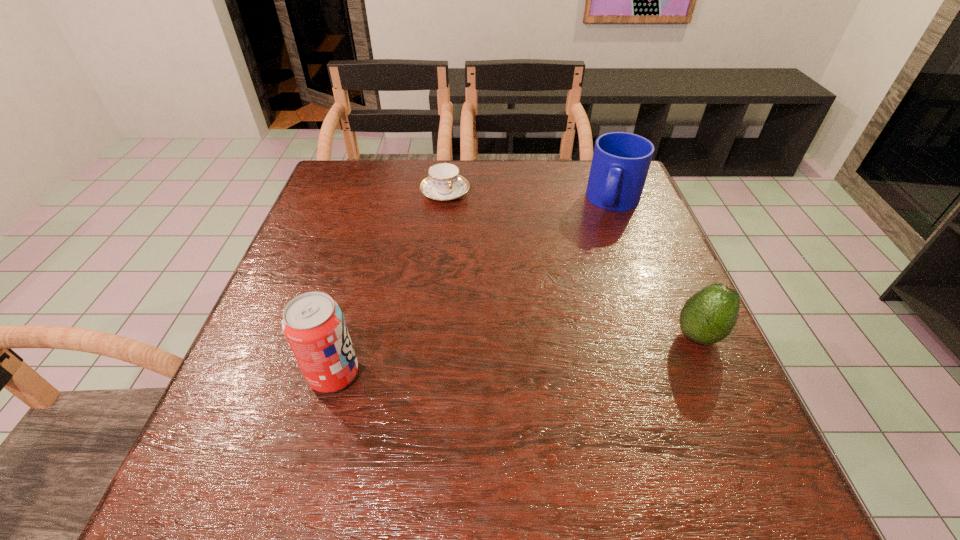
Locate an element on the screen. The width and height of the screenshot is (960, 540). soda can is located at coordinates (313, 323).

You are a GUI agent. You are given a task and a screenshot of the screen. Output one action in this format:
    pyautogui.click(x=<x>, y=<y>)
    Task: Click on the avocado
    The width and height of the screenshot is (960, 540).
    Given the screenshot: What is the action you would take?
    pyautogui.click(x=708, y=316)

Find the location of a particular element. The image size is (960, 540). the third object from right to left is located at coordinates (444, 183).

At what (x,y) coordinates should I click in order to perform the action: click on the shortest object. Please return your answer as a coordinate pair (x, y). This screenshot has height=540, width=960. Looking at the image, I should click on (444, 183).

At what (x,y) coordinates should I click in order to perform the action: click on mug. Please return your answer as a coordinate pair (x, y). The width and height of the screenshot is (960, 540). Looking at the image, I should click on (620, 164).

The height and width of the screenshot is (540, 960). Find the location of `vacant point located on the right of the leftmost object`. vacant point located on the right of the leftmost object is located at coordinates (414, 375).

In order to click on free spot located 0.220m on the left of the avocado in this screenshot , I will do `click(563, 336)`.

You are a GUI agent. You are given a task and a screenshot of the screen. Output one action in this format:
    pyautogui.click(x=<x>, y=<y>)
    Task: Click on the free spot located on the side with the handle of the third object from right to left
    The width and height of the screenshot is (960, 540).
    Given the screenshot: What is the action you would take?
    pyautogui.click(x=475, y=247)

This screenshot has width=960, height=540. In order to click on free spot located 0.110m on the side with the handle of the third object from right to left in this screenshot , I will do `click(466, 230)`.

Locate an element on the screen. Image resolution: width=960 pixels, height=540 pixels. free location located 0.310m on the side with the handle of the third object from right to left is located at coordinates (495, 282).